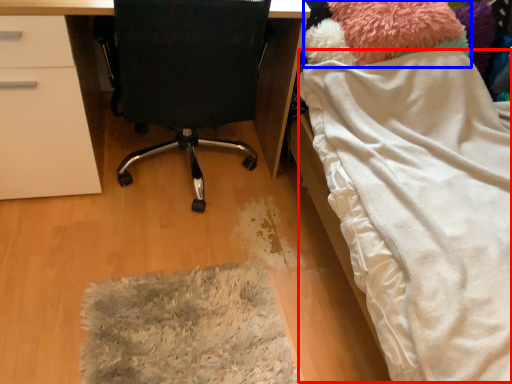
Question: Which object appears closest to the camera in this image, blanket (highlighted by a red box) or teddy (highlighted by a blue box)?

Choices:
 (A) blanket
 (B) teddy

Answer: (A)